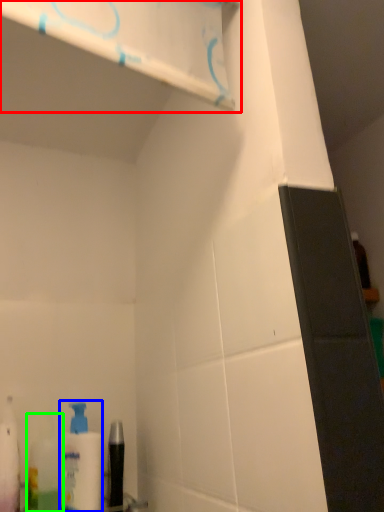
Question: Which is farther away from shelf (highlighted by a red box)? cleaning product (highlighted by a blue box) or mouthwash (highlighted by a green box)?

Choices:
 (A) cleaning product
 (B) mouthwash

Answer: (B)